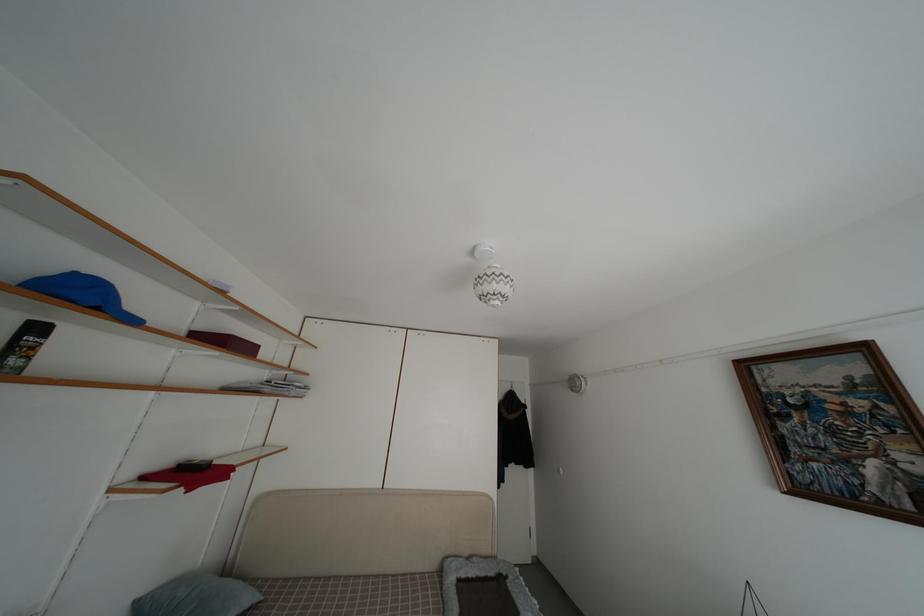
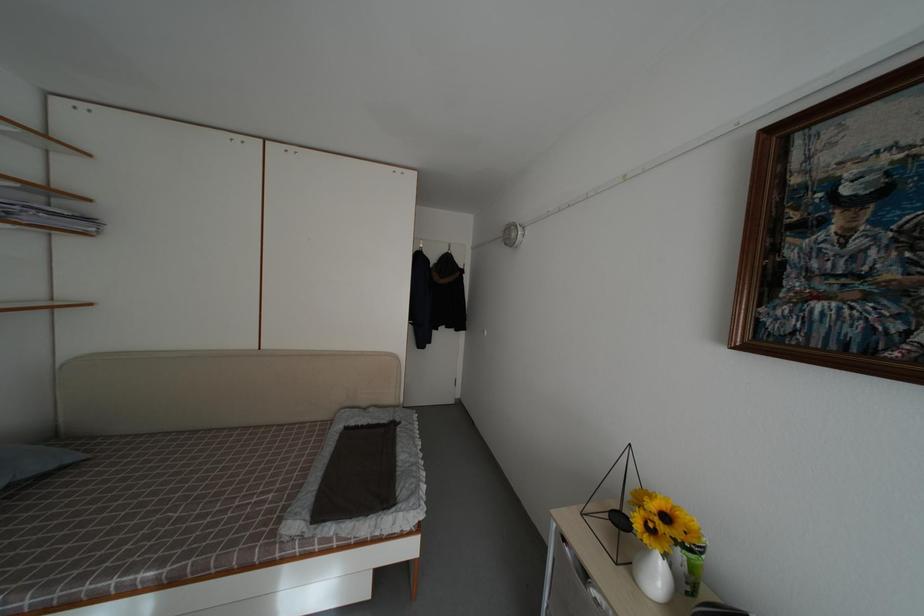
In the second image, find the point that corresponds to (480,565) in the first image.

(378, 416)